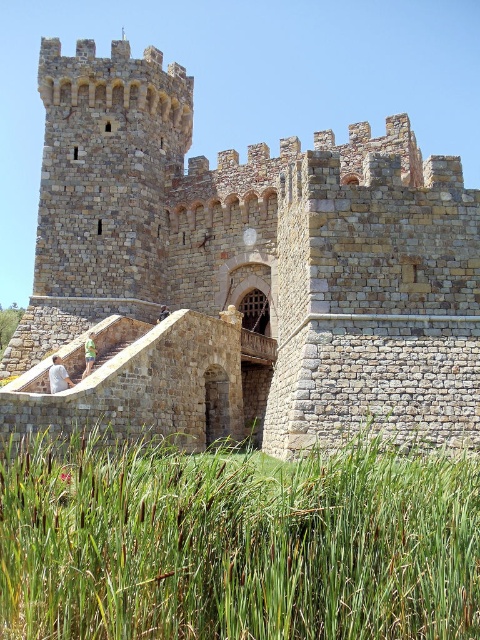
You are a knight approaching the castle. You see the brown stone castle at center and the green grass at lower center. Which object is located higher in the image?

The brown stone castle at center is positioned over green grass at lower center, so it is higher up in the image.

You are standing at the base of the castle and want to walk towards the green grass at lower center. Which direction should you move relative to the brown stone castle at center?

You should move to the right of the brown stone castle at center to reach the green grass at lower center since the brown stone castle at center is to the left of the green grass at lower center.